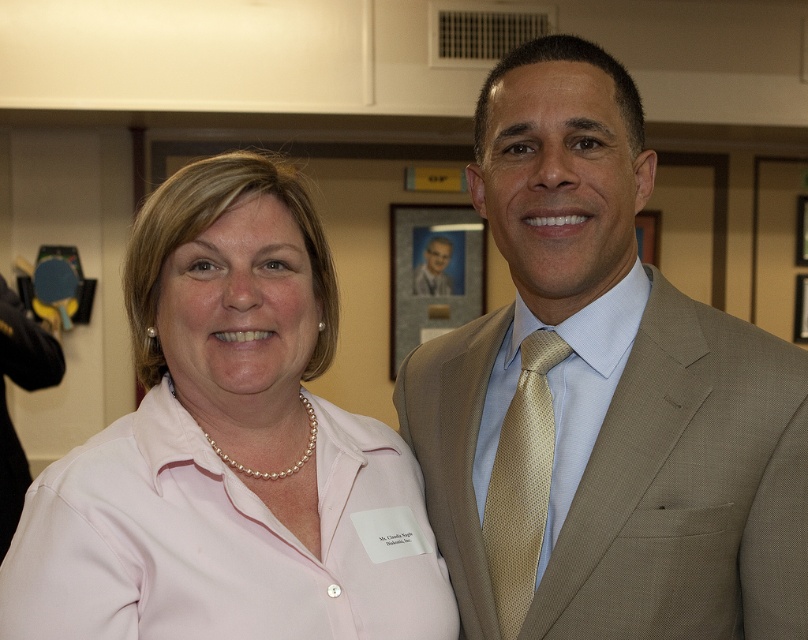
You are taking a photo of two people standing at the points labeled as point (767, 602) and point (545, 497). Which point is closer to the camera?

Point (767, 602) is closer to the camera than point (545, 497).

You are a photographer at a formal event and need to adjust the lighting to ensure both the tan textured suit at center and the light blue shirt at center are well lit. Since the camera focuses on the closest object first, which clothing item should you adjust the lighting for first?

The tan textured suit at center is closer to the viewer than the light blue shirt at center, so you should adjust the lighting for the tan textured suit at center first to ensure proper focus and lighting.

You are a photographer at a formal event and need to ensure both the tan textured suit at center and the light blue shirt at center are fully visible in your photo. Which clothing item requires more horizontal space to capture its full width?

The tan textured suit at center requires more horizontal space because its width surpasses that of the light blue shirt at center.